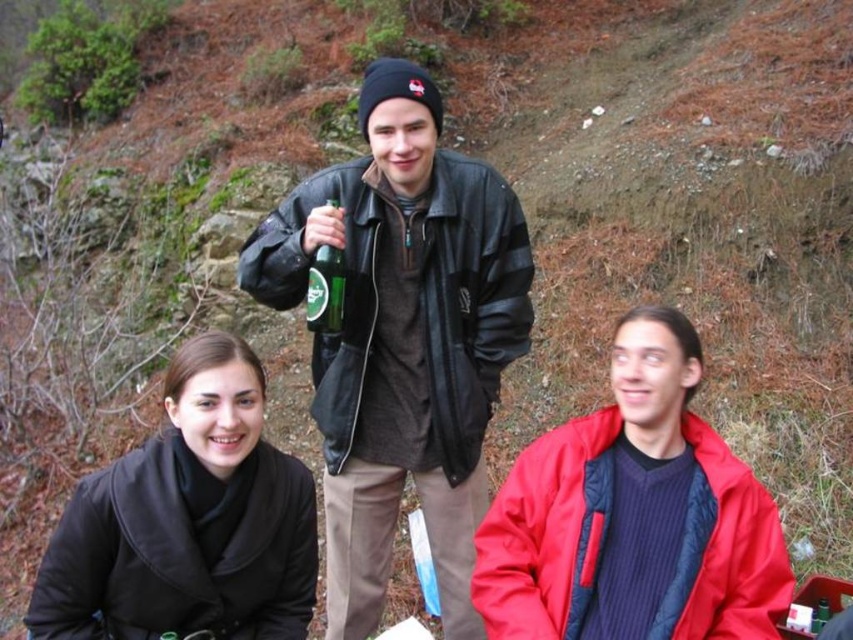
Question: Can you confirm if red matte jacket at center is positioned below black matte coat at lower left?

Choices:
 (A) yes
 (B) no

Answer: (B)

Question: Which object is the farthest from the green glass bottle at center?

Choices:
 (A) black matte coat at lower left
 (B) leather jacket at center

Answer: (A)

Question: Among these objects, which one is nearest to the camera?

Choices:
 (A) leather jacket at center
 (B) black matte coat at lower left

Answer: (B)

Question: Is red matte jacket at center thinner than green glass bottle at center?

Choices:
 (A) yes
 (B) no

Answer: (B)

Question: Among these points, which one is farthest from the camera?

Choices:
 (A) (321, 273)
 (B) (457, 184)

Answer: (B)

Question: Does leather jacket at center have a larger size compared to green glass bottle at center?

Choices:
 (A) no
 (B) yes

Answer: (B)